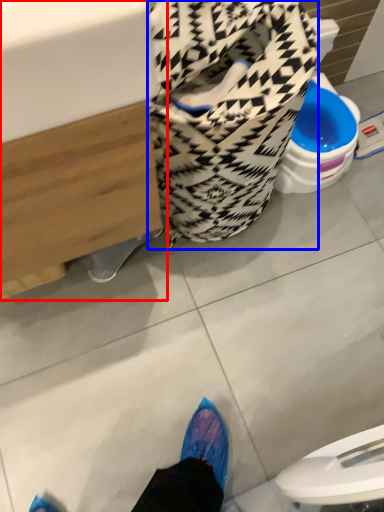
Question: Which object appears closest to the camera in this image, sink (highlighted by a red box) or laundry basket (highlighted by a blue box)?

Choices:
 (A) sink
 (B) laundry basket

Answer: (A)